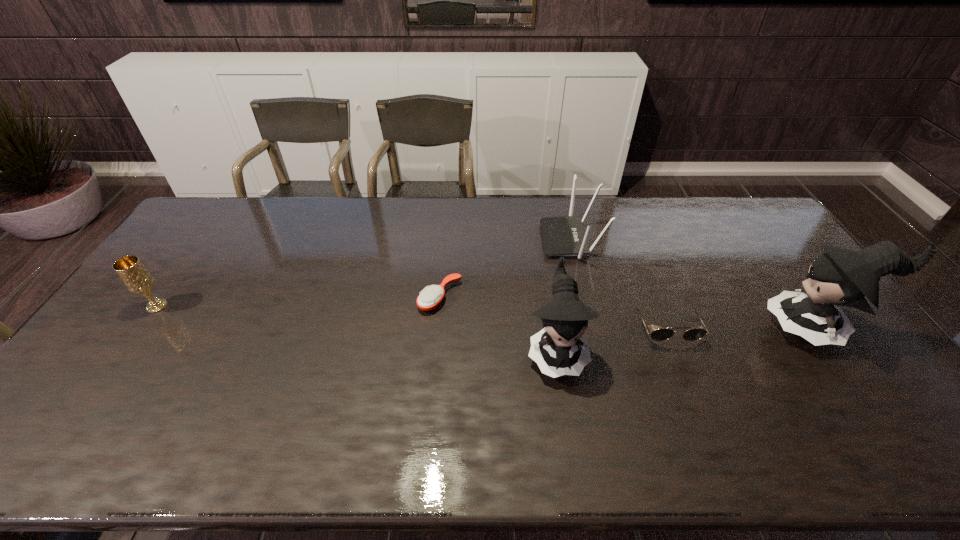
Please point a free position for a doll on the left. Please provide its 2D coordinates. Your answer should be formatted as a tuple, i.e. [(x, y)], where the tuple contains the x and y coordinates of a point satisfying the conditions above.

[(272, 373)]